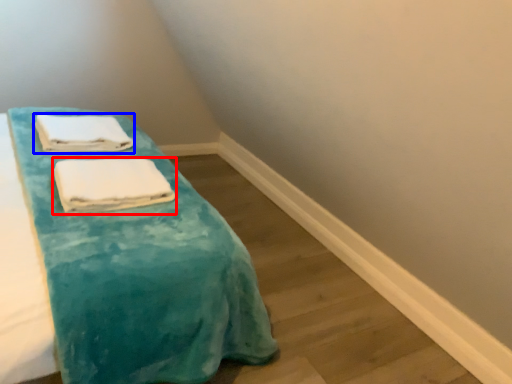
Question: Which of the following is the farthest to the observer, towel (highlighted by a red box) or towel (highlighted by a blue box)?

Choices:
 (A) towel
 (B) towel

Answer: (B)